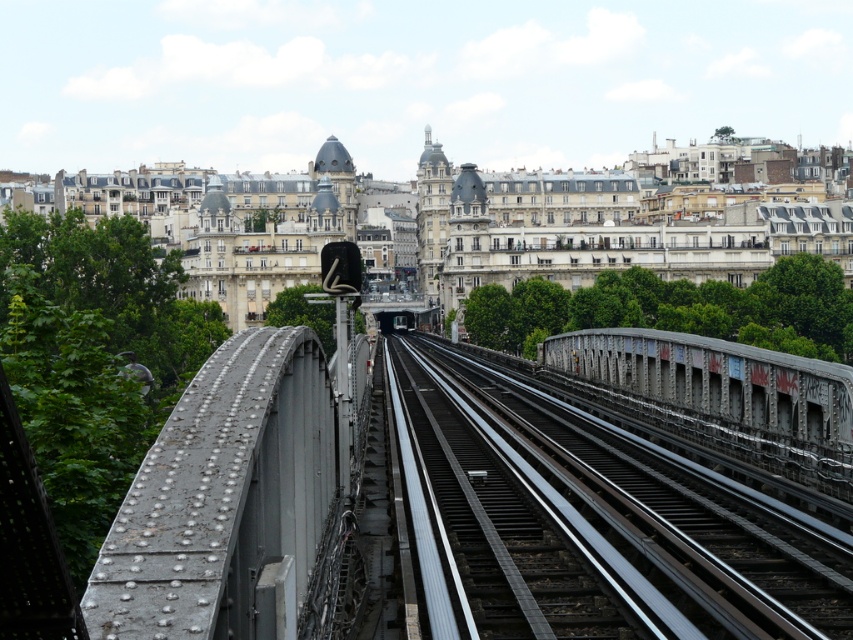
Question: Considering the relative positions of metal/rough track at center and rusty metal bridge at center in the image provided, where is metal/rough track at center located with respect to rusty metal bridge at center?

Choices:
 (A) above
 (B) below

Answer: (B)

Question: Among these points, which one is nearest to the camera?

Choices:
 (A) (769, 433)
 (B) (604, 605)

Answer: (B)

Question: Among these points, which one is nearest to the camera?

Choices:
 (A) (737, 436)
 (B) (471, 390)

Answer: (A)

Question: Can you confirm if metal/rough track at center is positioned below rusty metal bridge at center?

Choices:
 (A) yes
 (B) no

Answer: (A)

Question: Is metal/rough track at center thinner than rusty metal bridge at center?

Choices:
 (A) no
 (B) yes

Answer: (A)